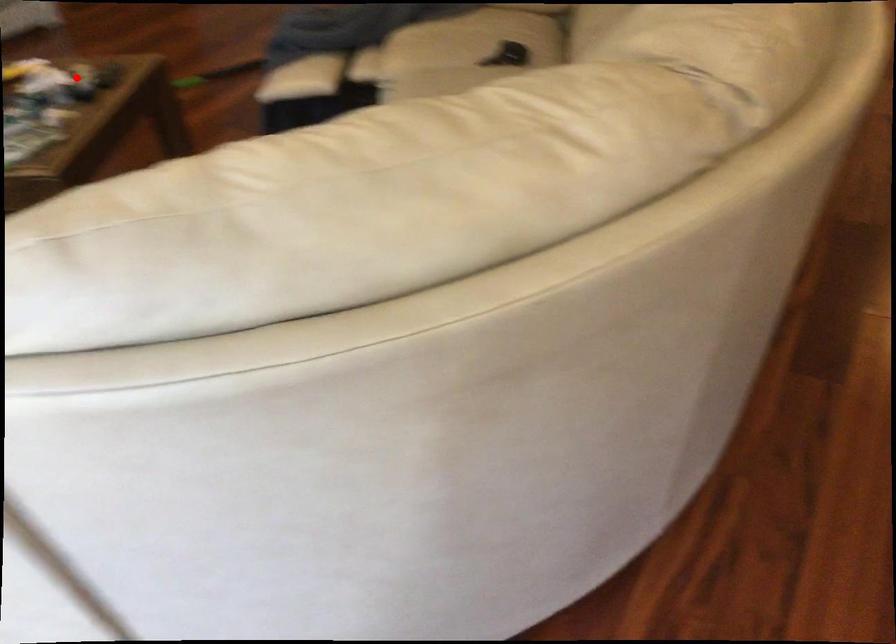
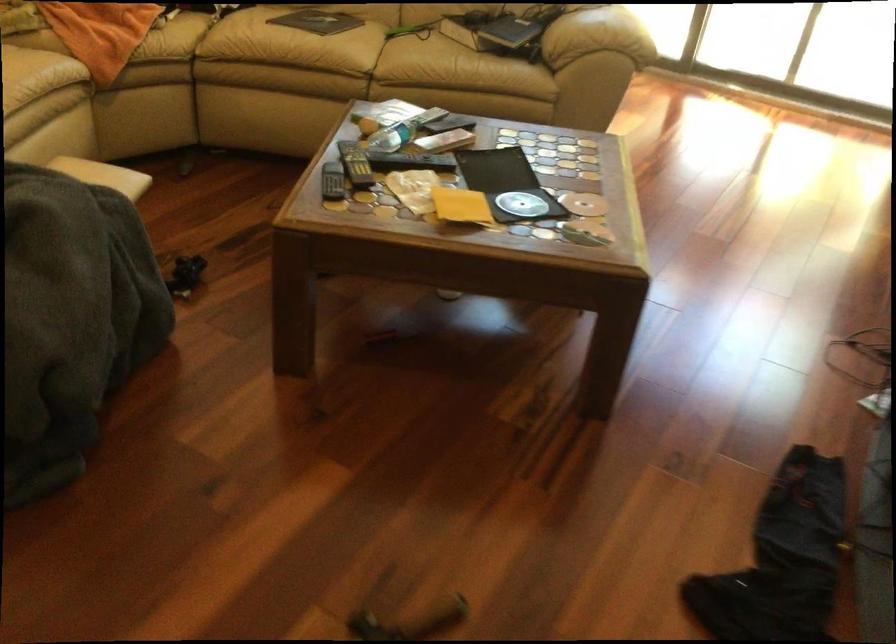
Question: I am providing you with two images of the same scene from different viewpoints. Image1 has a red point marked. In image2, the corresponding 3D location appears at what relative position? Reply with the corresponding letter.

Choices:
 (A) Closer
 (B) Farther

Answer: (A)